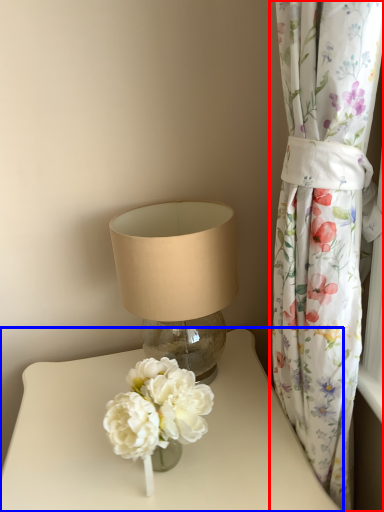
Question: Which object is closer to the camera taking this photo, curtain (highlighted by a red box) or table (highlighted by a blue box)?

Choices:
 (A) curtain
 (B) table

Answer: (A)